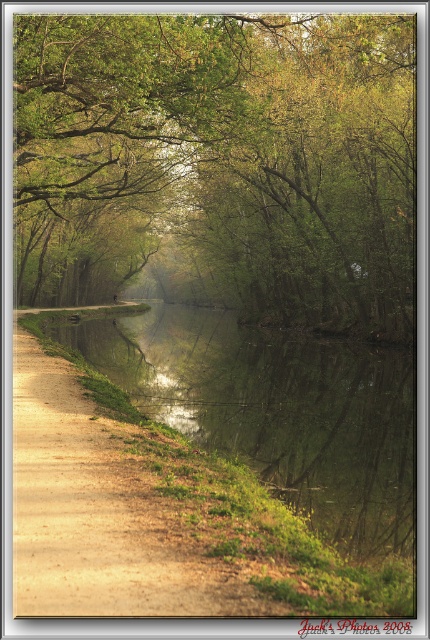
You are standing on the brown dirt path at left and want to see the green leafy trees at center. Which direction should you look to see them?

The green leafy trees at center are located above the brown dirt path at left, so you should look upward to see them.

You are standing at the edge of the canal and want to reach the point marked as point (x=365, y=272). Given that your walking speed is 3 feet per second, how many seconds will it take you to reach that point?

The distance between you and point (x=365, y=272) is 156.83 feet. At a speed of 3 feet per second, it will take approximately 52.28 seconds to reach the point.

You are planning to take a photo of the green reflective water at center and the brown dirt path at left in this scene. Which object would you need to frame more prominently in your shot to ensure it stands out, considering their sizes?

The green reflective water at center should be framed more prominently since it is larger in size than the brown dirt path at left, making it a more dominant element in the scene.